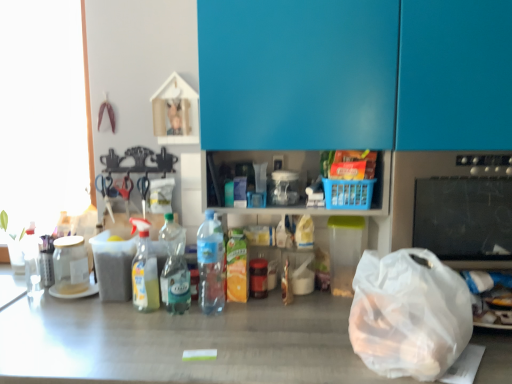
Question: Considering their positions, is translucent plastic bottle at center, arranged as the first bottle when viewed from the right, located in front of or behind transparent glass jar at left, the fourth bottle in the right-to-left sequence?

Choices:
 (A) front
 (B) behind

Answer: (A)

Question: Based on their positions, is translucent plastic bottle at center, which ranks as the fourth bottle in left-to-right order, located to the left or right of transparent glass jar at left, the fourth bottle in the right-to-left sequence?

Choices:
 (A) right
 (B) left

Answer: (A)

Question: Which of these objects is positioned closest to the transparent plastic bag at lower right?

Choices:
 (A) translucent plastic bottle at center, which ranks as the fourth bottle in left-to-right order
 (B) translucent plastic spray bottle at center, placed as the 2th bottle when sorted from left to right
 (C) transparent glass jar at left, the fourth bottle in the right-to-left sequence
 (D) blue glossy cabinet at upper center
 (E) black glass stove at right

Answer: (E)

Question: Estimate the real-world distances between objects in this image. Which object is closer to the translucent plastic spray bottle at center, placed as the 2th bottle when sorted from left to right?

Choices:
 (A) transparent glass jar at left, the 1th bottle in the left-to-right sequence
 (B) transparent plastic bag at lower right
 (C) translucent plastic bottle at center, acting as the 2th bottle starting from the right
 (D) translucent plastic bottle at center, arranged as the first bottle when viewed from the right
 (E) black glass stove at right

Answer: (C)